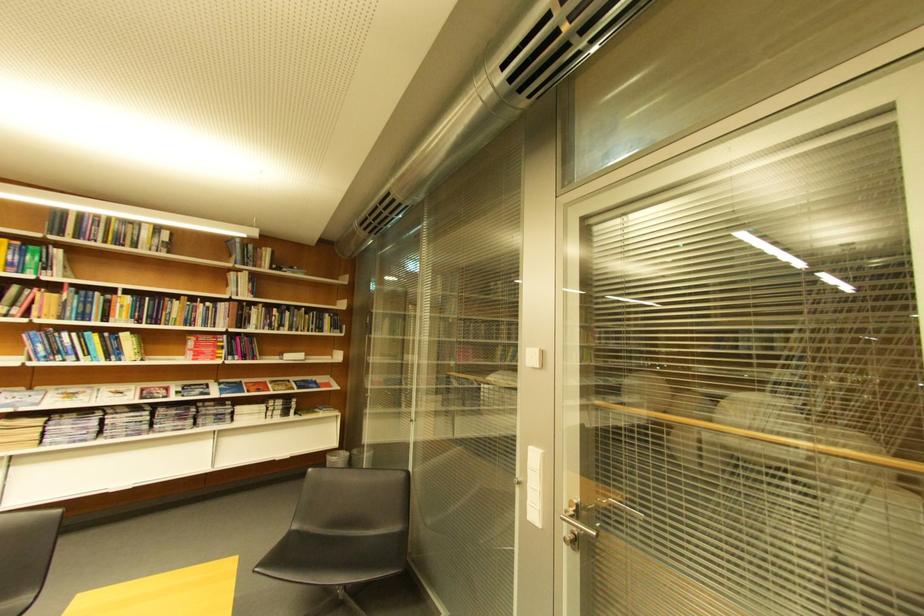
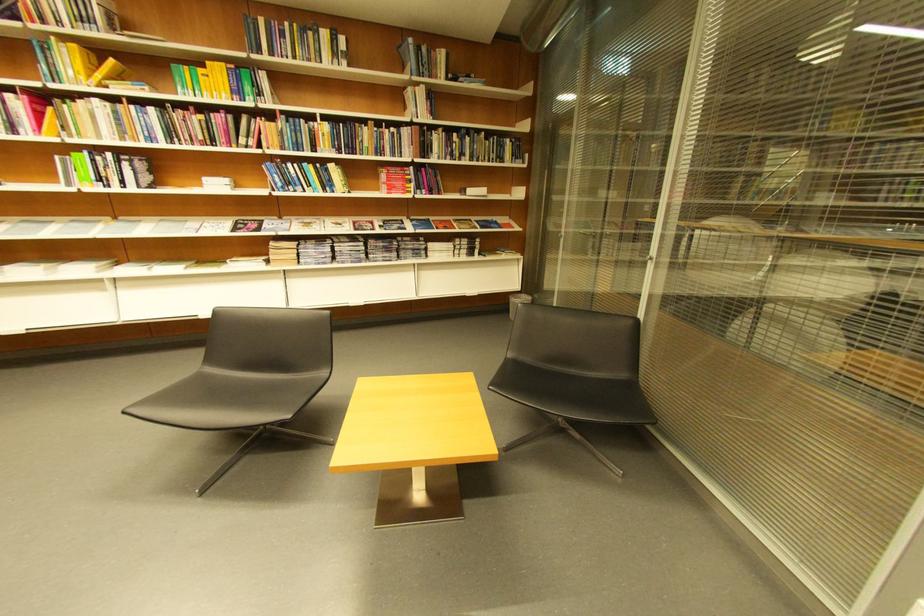
Locate, in the second image, the point that corresponds to (x=264, y=268) in the first image.

(441, 78)